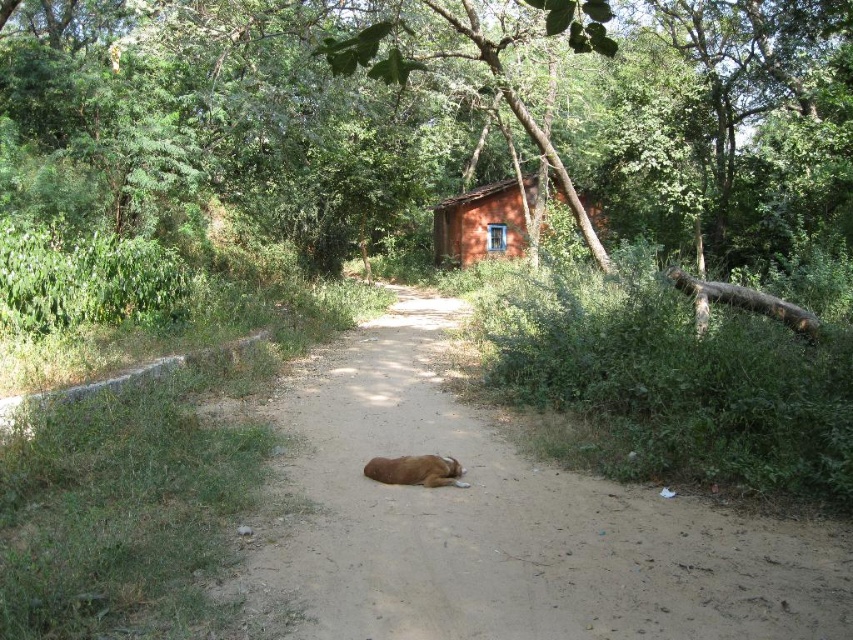
Between brown dirt track at center and orange clay cabin at center, which one is positioned higher?

orange clay cabin at center is above.

Is brown dirt track at center wider than orange clay cabin at center?

In fact, brown dirt track at center might be narrower than orange clay cabin at center.

Describe the element at coordinates (502, 524) in the screenshot. I see `brown dirt track at center` at that location.

What are the coordinates of `brown dirt track at center` in the screenshot? It's located at (502, 524).

Does brown dirt track at center have a greater width compared to brown furry dog at center?

Indeed, brown dirt track at center has a greater width compared to brown furry dog at center.

Consider the image. Who is positioned more to the right, brown dirt track at center or brown furry dog at center?

brown furry dog at center is more to the right.

Locate an element on the screen. The height and width of the screenshot is (640, 853). brown dirt track at center is located at coordinates (502, 524).

Where is `orange clay cabin at center`? The height and width of the screenshot is (640, 853). orange clay cabin at center is located at coordinates (480, 225).

Is orange clay cabin at center positioned at the back of brown furry dog at center?

Yes.

What do you see at coordinates (480, 225) in the screenshot? This screenshot has width=853, height=640. I see `orange clay cabin at center` at bounding box center [480, 225].

The height and width of the screenshot is (640, 853). I want to click on orange clay cabin at center, so click(480, 225).